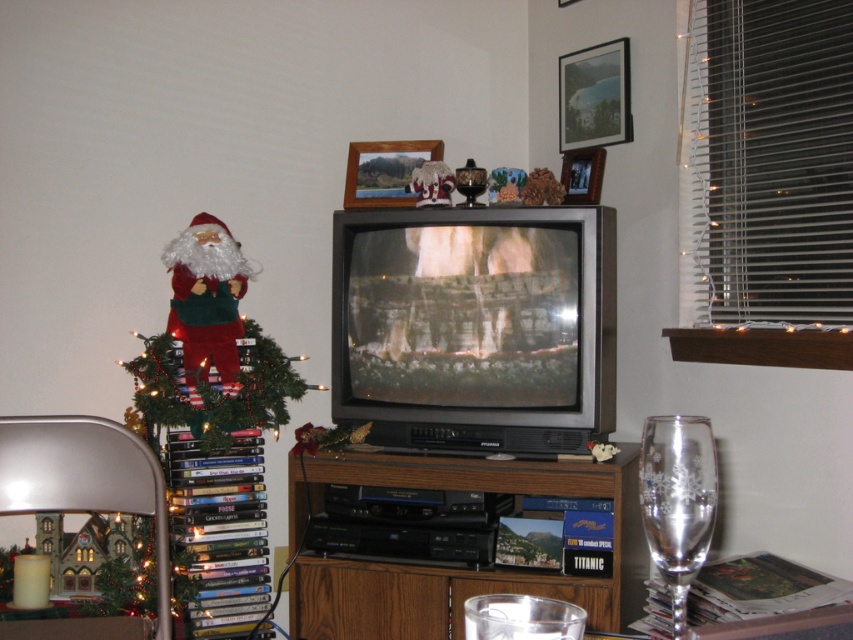
The width and height of the screenshot is (853, 640). What do you see at coordinates (460, 566) in the screenshot?
I see `brown wood entertainment center at center` at bounding box center [460, 566].

Can you confirm if brown wood entertainment center at center is shorter than green matte christmas tree at left?

Correct, brown wood entertainment center at center is not as tall as green matte christmas tree at left.

Locate an element on the screen. Image resolution: width=853 pixels, height=640 pixels. brown wood entertainment center at center is located at coordinates (460, 566).

Can you confirm if clear glass wine glass at lower right is smaller than fuzzy fabric santa at left?

Correct, clear glass wine glass at lower right occupies less space than fuzzy fabric santa at left.

Is point (647, 422) positioned behind point (218, 308)?

No, (647, 422) is closer to viewer.

Find the location of a particular element. The height and width of the screenshot is (640, 853). clear glass wine glass at lower right is located at coordinates (677, 500).

Between brown wood entertainment center at center and fuzzy fabric santa at left, which one is positioned lower?

brown wood entertainment center at center is below.

How distant is brown wood entertainment center at center from fuzzy fabric santa at left?

24.09 inches

Is point (515, 586) farther from viewer compared to point (199, 304)?

That is False.

Image resolution: width=853 pixels, height=640 pixels. Identify the location of brown wood entertainment center at center. (460, 566).